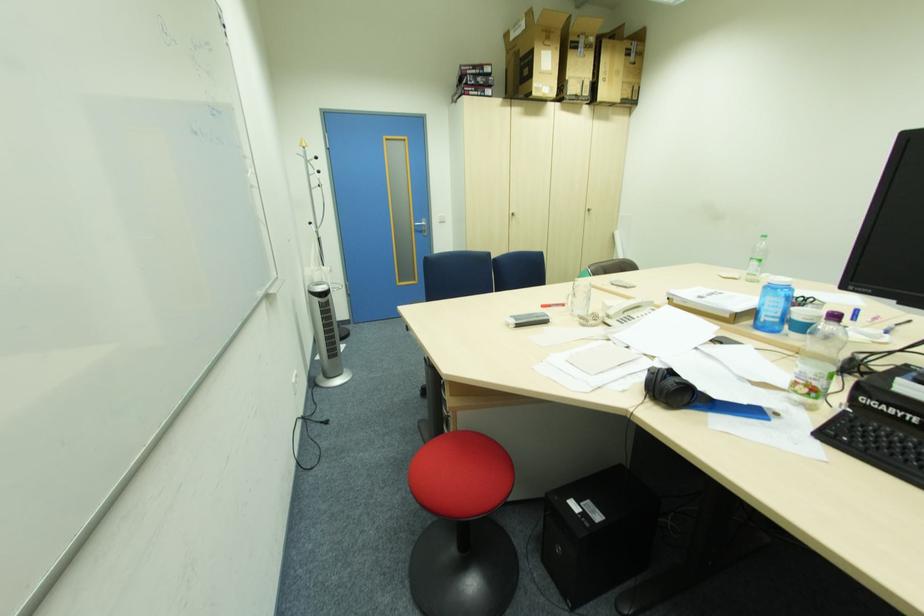
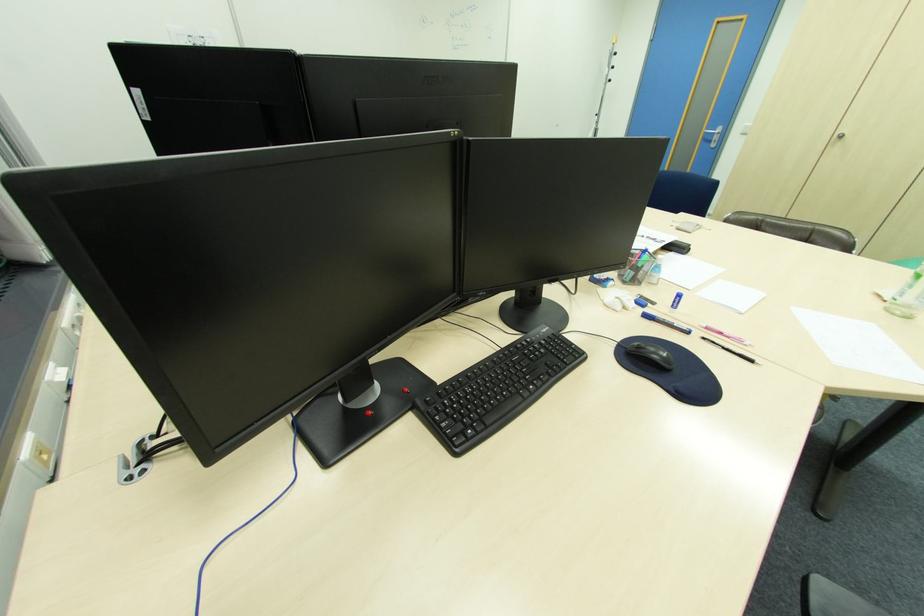
In the second image, find the point that corresponds to [424,230] in the first image.

(713, 139)